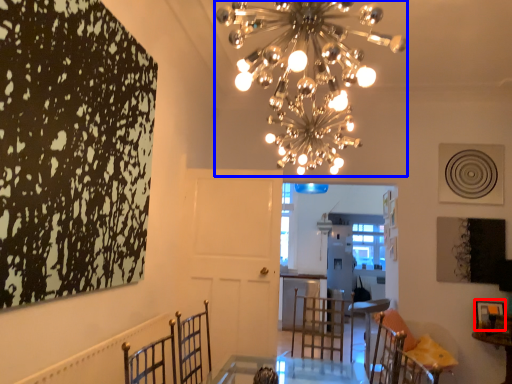
Question: Which point is closer to the camera, picture frame (highlighted by a red box) or chandelier (highlighted by a blue box)?

Choices:
 (A) picture frame
 (B) chandelier

Answer: (B)